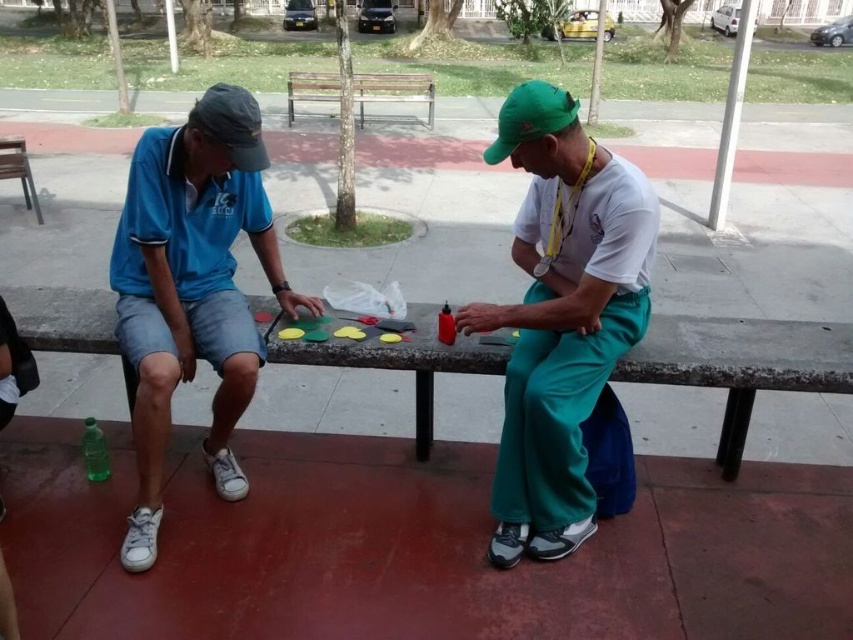
You are a photographer trying to capture a candid shot of the white matte shirt at center and the blue cotton shirt at left. Since you want to focus on the shirts, you need to ensure they are both in the frame. Given their positions, which shirt should you adjust your camera angle to prioritize to keep both in view?

The white matte shirt at center is located below the blue cotton shirt at left, so you should angle your camera downward to ensure both shirts remain in the frame.

You are a photographer taking a picture of the blue cotton shirt at left and the matte black baseball cap at left. Which object should you focus on first if you want to capture both in sharp focus?

The blue cotton shirt at left is located below matte black baseball cap at left, so you should focus on the matte black baseball cap at left first as it is closer to the camera.